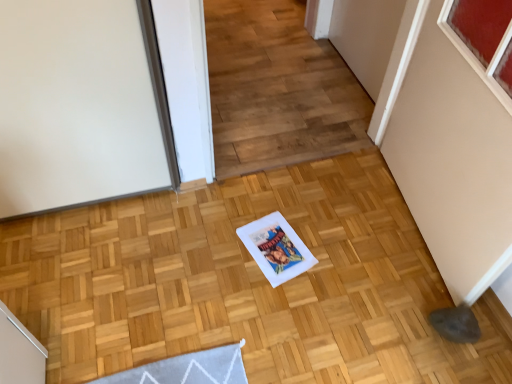
The height and width of the screenshot is (384, 512). Identify the location of vacant space in front of white glossy postcard at center. (274, 303).